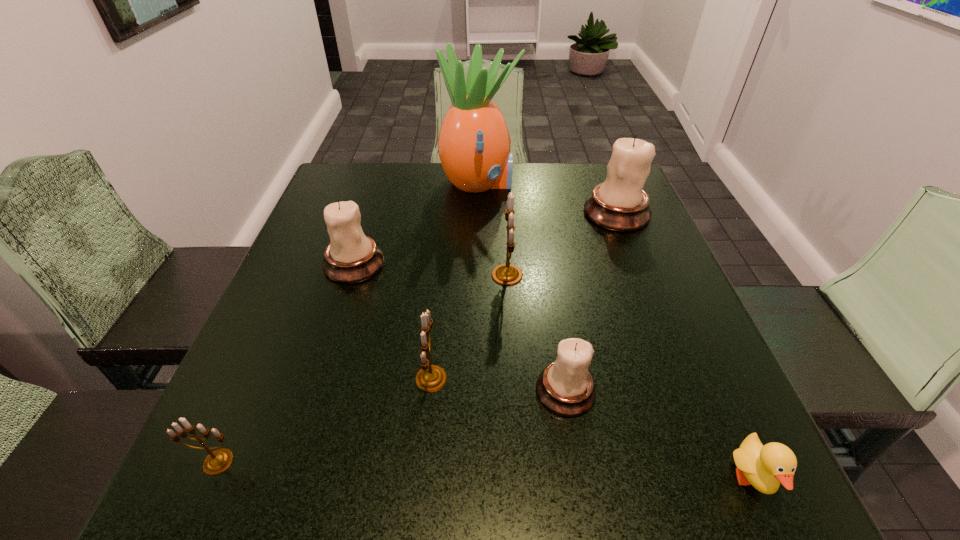
This screenshot has width=960, height=540. Find the location of `object at the far right corner`. object at the far right corner is located at coordinates (620, 204).

The width and height of the screenshot is (960, 540). What are the coordinates of `object at the near right corner` in the screenshot? It's located at (764, 467).

Where is `vacant region at the far edge of the desktop`? The height and width of the screenshot is (540, 960). vacant region at the far edge of the desktop is located at coordinates (470, 206).

The height and width of the screenshot is (540, 960). In the image, there is a desktop. Identify the location of vacant space at the near edge. (529, 469).

Find the location of `free space at the left edge of the desktop`. free space at the left edge of the desktop is located at coordinates (317, 332).

In the image, there is a desktop. Identify the location of vacant space at the right edge. (625, 331).

This screenshot has width=960, height=540. Identify the location of vacant space at the near left corner of the desktop. (256, 491).

The image size is (960, 540). I want to click on vacant region at the far right corner of the desktop, so click(x=602, y=178).

Locate an element on the screen. The height and width of the screenshot is (540, 960). free space at the near right corner of the desktop is located at coordinates click(755, 511).

This screenshot has width=960, height=540. I want to click on empty location between the rightmost white candle holder and the second candelabrum from right to left, so click(591, 302).